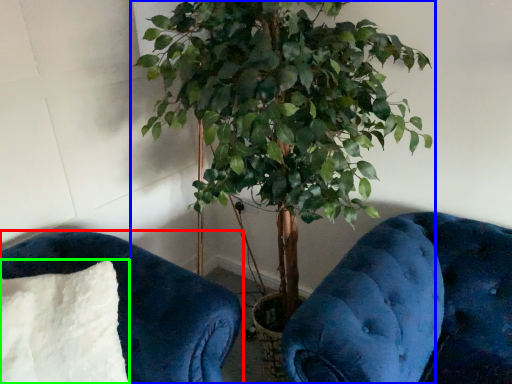
Question: Which is farther away from furniture (highlighted by a red box)? houseplant (highlighted by a blue box) or pillow (highlighted by a green box)?

Choices:
 (A) houseplant
 (B) pillow

Answer: (A)